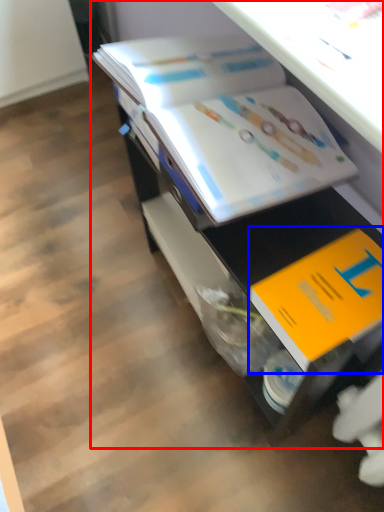
Question: Which of the following is the closest to the observer, desk (highlighted by a red box) or book (highlighted by a blue box)?

Choices:
 (A) desk
 (B) book

Answer: (A)